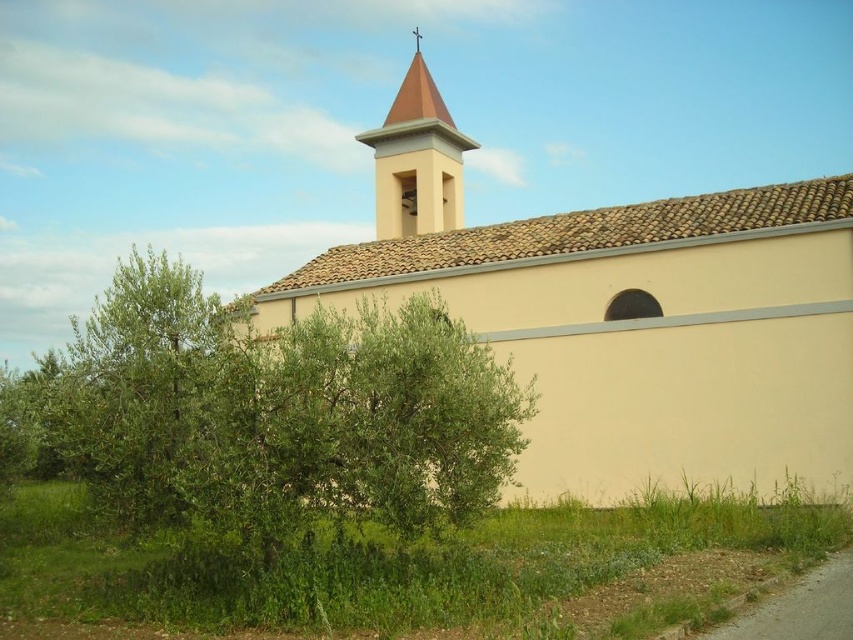
Question: Does beige stucco church at center appear on the right side of green leafy tree at center?

Choices:
 (A) no
 (B) yes

Answer: (B)

Question: Which of the following is the farthest from the observer?

Choices:
 (A) matte yellow bell tower at upper center
 (B) beige stucco church at center
 (C) green leafy tree at center

Answer: (A)

Question: Is beige stucco church at center wider than matte yellow bell tower at upper center?

Choices:
 (A) no
 (B) yes

Answer: (B)

Question: Which point is farther to the camera?

Choices:
 (A) (766, 468)
 (B) (279, 497)
 (C) (387, 122)

Answer: (C)

Question: Can you confirm if beige stucco church at center is positioned to the right of matte yellow bell tower at upper center?

Choices:
 (A) no
 (B) yes

Answer: (B)

Question: Which object is the closest to the matte yellow bell tower at upper center?

Choices:
 (A) green leafy tree at center
 (B) beige stucco church at center

Answer: (B)